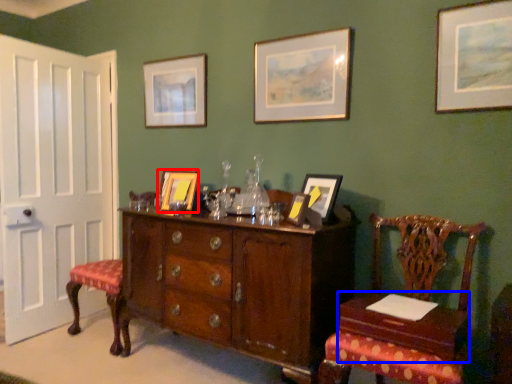
Question: Which object appears closest to the camera in this image, picture frame (highlighted by a red box) or table (highlighted by a blue box)?

Choices:
 (A) picture frame
 (B) table

Answer: (B)